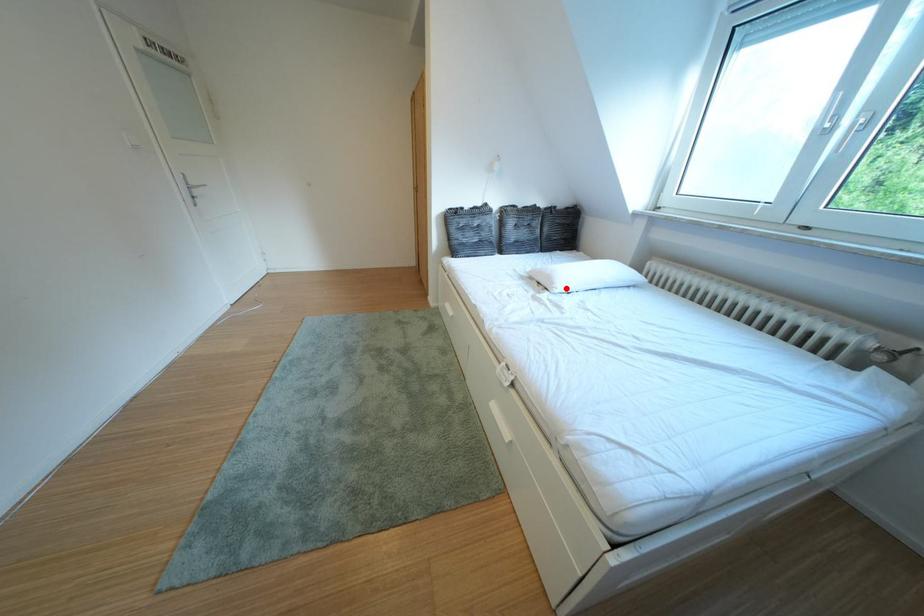
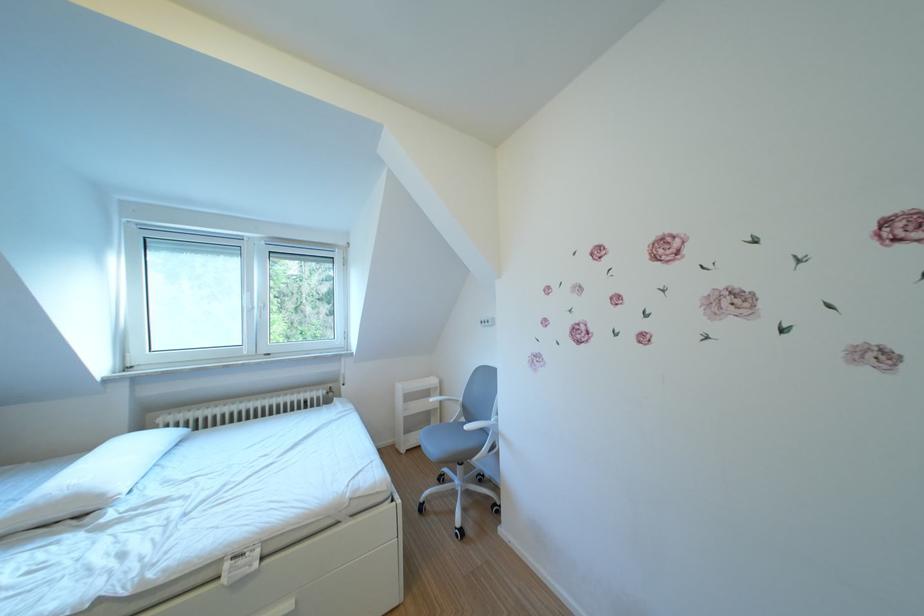
Locate, in the second image, the point that corresponds to the highlighted location in the first image.

(115, 501)